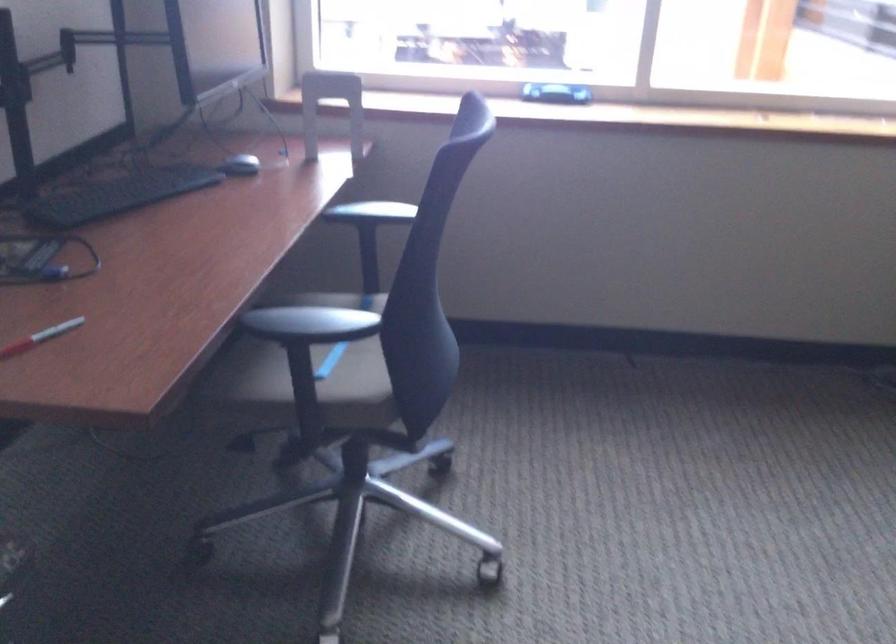
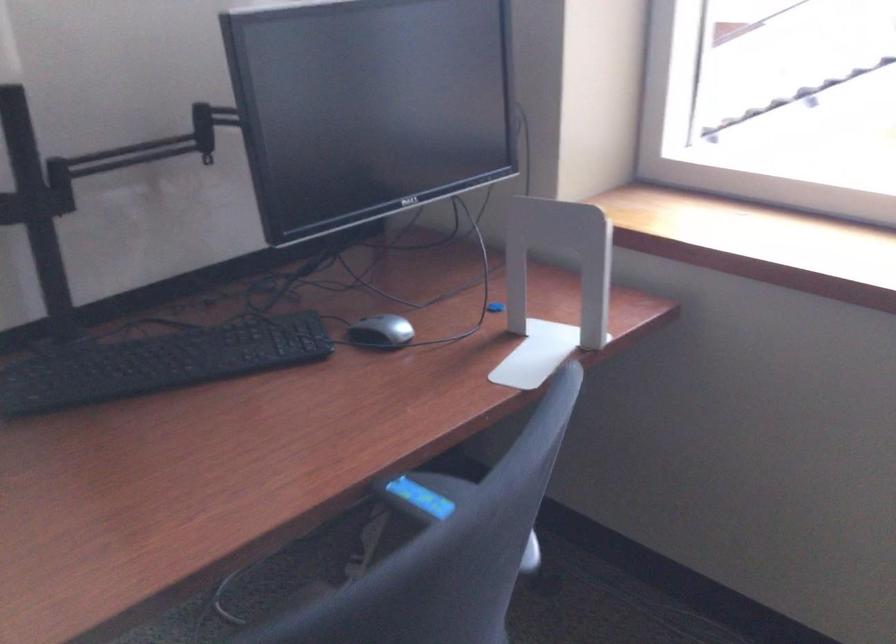
In the second image, find the point that corresponds to the point at 247,165 in the first image.

(381, 332)